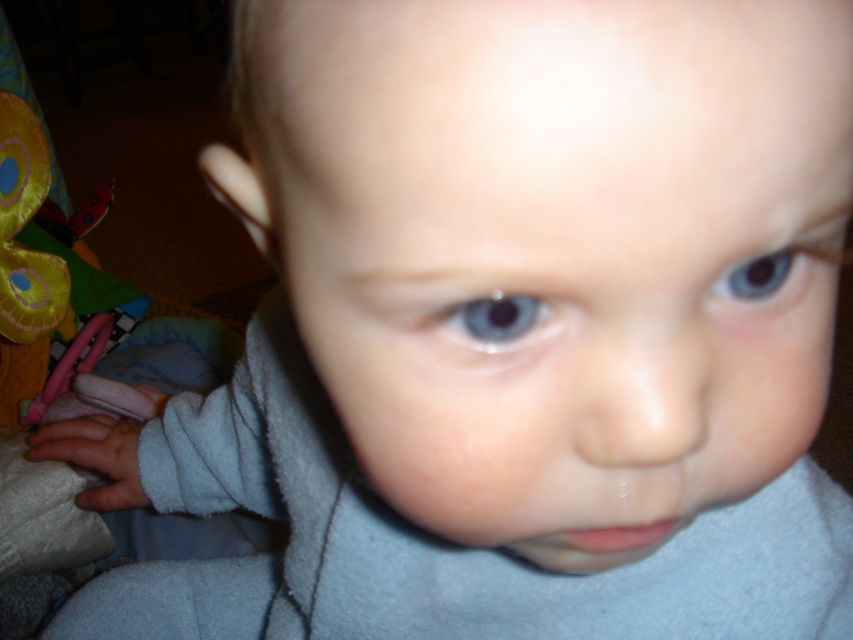
You are a pediatrician examining a baby. You notice the blue glossy eye at center and the blue glossy eye at upper center. How far apart are these two eyes?

The blue glossy eye at center and the blue glossy eye at upper center are 5.06 centimeters apart from each other.